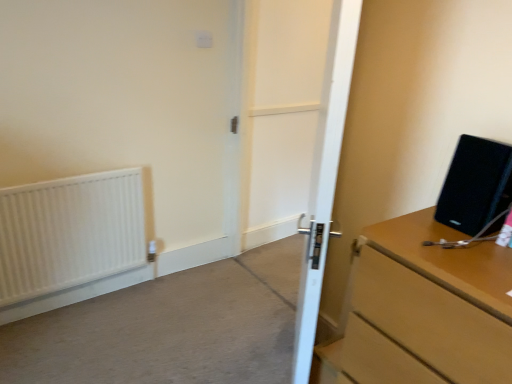
What do you see at coordinates (282, 113) in the screenshot?
I see `white wooden door at center` at bounding box center [282, 113].

Locate an element on the screen. This screenshot has width=512, height=384. wooden chest of drawers at right is located at coordinates (422, 310).

The height and width of the screenshot is (384, 512). Describe the element at coordinates (325, 178) in the screenshot. I see `white wooden door at center` at that location.

The height and width of the screenshot is (384, 512). What do you see at coordinates (475, 185) in the screenshot?
I see `black matte speaker at right` at bounding box center [475, 185].

You are a GUI agent. You are given a task and a screenshot of the screen. Output one action in this format:
    pyautogui.click(x=<x>, y=<y>)
    Task: Click on the white wooden door at center
    This screenshot has height=384, width=512.
    Given the screenshot: What is the action you would take?
    pyautogui.click(x=282, y=113)

Are white wooden door at center and wooden chest of drawers at right located far from each other?

white wooden door at center is far away from wooden chest of drawers at right.

Is white wooden door at center closer to the viewer compared to wooden chest of drawers at right?

No, the depth of white wooden door at center is greater than that of wooden chest of drawers at right.

Between point (273, 104) and point (509, 372), which one is positioned in front?

The point (509, 372) is closer to the camera.

From a real-world perspective, which is physically above, white wooden door at center or wooden chest of drawers at right?

white wooden door at center, from a real-world perspective.

Could you tell me if wooden chest of drawers at right is turned towards white wooden door at center?

No, wooden chest of drawers at right does not turn towards white wooden door at center.

Is wooden chest of drawers at right wider than white wooden door at center?

Yes, wooden chest of drawers at right is wider than white wooden door at center.

Which object is positioned more to the left, wooden chest of drawers at right or white wooden door at center?

From the viewer's perspective, white wooden door at center appears more on the left side.

In the scene shown: Considering the sizes of white matte radiator at left and black matte speaker at right in the image, is white matte radiator at left wider or thinner than black matte speaker at right?

Considering their sizes, white matte radiator at left looks slimmer than black matte speaker at right.

From the image's perspective, which one is positioned higher, white matte radiator at left or black matte speaker at right?

black matte speaker at right, from the image's perspective.

From a real-world perspective, is white matte radiator at left physically above black matte speaker at right?

Actually, white matte radiator at left is physically below black matte speaker at right in the real world.

Find the location of a particular element. radiator behind the black matte speaker at right is located at coordinates (69, 233).

Does black matte speaker at right have a greater width compared to white wooden door at center?

Yes.

Who is smaller, black matte speaker at right or white wooden door at center?

black matte speaker at right is smaller.

Between black matte speaker at right and white wooden door at center, which one appears on the right side from the viewer's perspective?

From the viewer's perspective, black matte speaker at right appears more on the right side.

Is black matte speaker at right completely or partially outside of white wooden door at center?

Yes.

Is white wooden door at center closer to camera compared to white wooden door at center?

No, white wooden door at center is further to the viewer.

Between white wooden door at center and white wooden door at center, which one has smaller size?

white wooden door at center is smaller.

Could you tell me if white wooden door at center is facing white wooden door at center?

No, white wooden door at center is not oriented towards white wooden door at center.

From the image's perspective, which is above, white wooden door at center or white wooden door at center?

white wooden door at center appears higher in the image.

Is white wooden door at center not inside white matte radiator at left?

white wooden door at center lies outside white matte radiator at left's area.

How far apart are white wooden door at center and white matte radiator at left?

white wooden door at center and white matte radiator at left are 4.21 feet apart from each other.

Is point (336, 11) positioned behind point (12, 236)?

No.

What's the angular difference between white wooden door at center and black matte speaker at right's facing directions?

The angular difference between white wooden door at center and black matte speaker at right is 0.089 degrees.

Is point (284, 213) farther from viewer compared to point (475, 219)?

Yes.

From the image's perspective, which one is positioned lower, white wooden door at center or black matte speaker at right?

black matte speaker at right, from the image's perspective.

Identify the location of the chest of drawers directly beneath the white wooden door at center (from a real-world perspective). (422, 310).

The image size is (512, 384). I want to click on the chest of drawers in front of the white wooden door at center, so click(422, 310).

Looking at the image, which one is located closer to white matte radiator at left, black matte speaker at right or white wooden door at center?

white wooden door at center is closer to white matte radiator at left.

When comparing their distances from white wooden door at center, does white matte radiator at left or black matte speaker at right seem further?

The object further to white wooden door at center is black matte speaker at right.

Considering their positions, is white wooden door at center positioned further to white wooden door at center than wooden chest of drawers at right?

wooden chest of drawers at right is positioned further to the anchor white wooden door at center.

Considering their positions, is black matte speaker at right positioned further to wooden chest of drawers at right than white matte radiator at left?

white matte radiator at left is further to wooden chest of drawers at right.

Looking at the image, which one is located closer to white wooden door at center, wooden chest of drawers at right or white wooden door at center?

wooden chest of drawers at right lies closer to white wooden door at center than the other object.

Estimate the real-world distances between objects in this image. Which object is closer to white wooden door at center, white wooden door at center or black matte speaker at right?

black matte speaker at right lies closer to white wooden door at center than the other object.

When comparing their distances from white matte radiator at left, does black matte speaker at right or wooden chest of drawers at right seem further?

Based on the image, black matte speaker at right appears to be further to white matte radiator at left.

Based on their spatial positions, is white wooden door at center or white wooden door at center further from white matte radiator at left?

white wooden door at center is further to white matte radiator at left.

Where is `door between white matte radiator at left and black matte speaker at right from left to right`? The image size is (512, 384). door between white matte radiator at left and black matte speaker at right from left to right is located at coordinates (325, 178).

I want to click on the chest of drawers located between white matte radiator at left and black matte speaker at right in the left-right direction, so click(x=422, y=310).

Identify the location of screen door situated between white matte radiator at left and white wooden door at center from left to right. Image resolution: width=512 pixels, height=384 pixels. (282, 113).

Locate an element on the screen. desktop computer positioned between white wooden door at center and white wooden door at center from near to far is located at coordinates tap(475, 185).